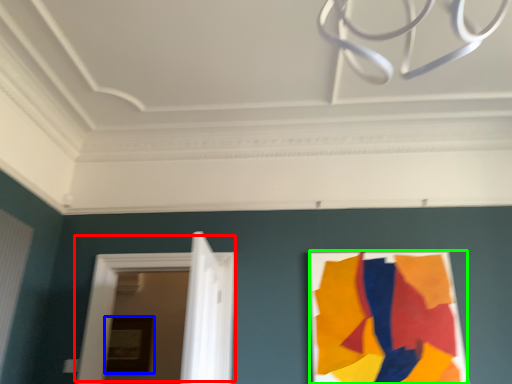
Question: Which object is the closest to the door (highlighted by a red box)? Choose among these: picture frame (highlighted by a blue box) or poster (highlighted by a green box).

Choices:
 (A) picture frame
 (B) poster

Answer: (B)